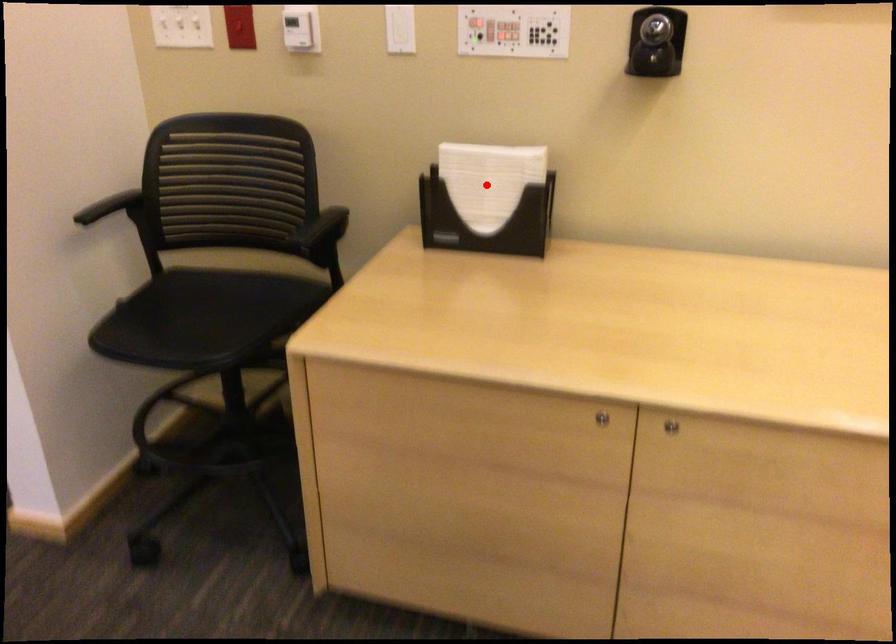
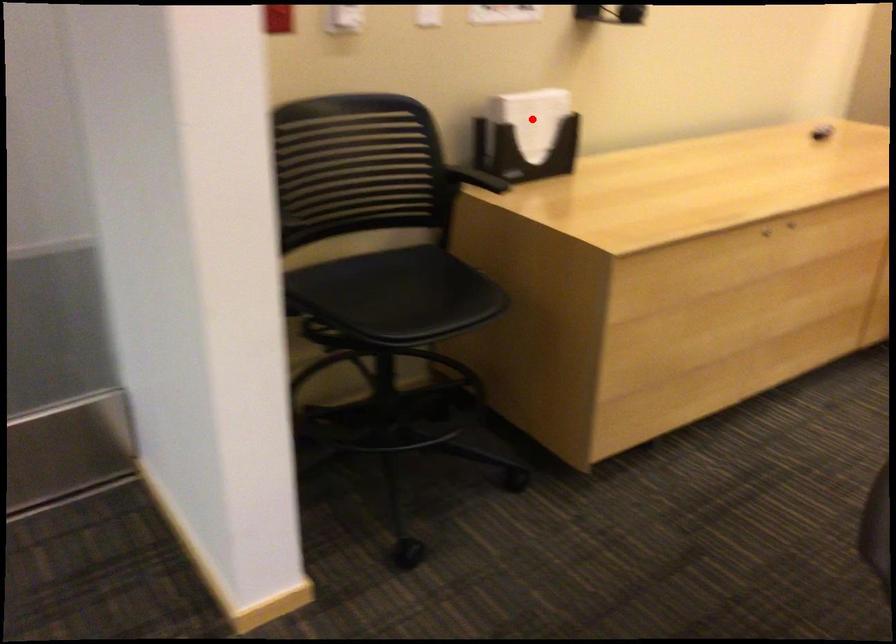
I am providing you with two images of the same scene from different viewpoints. A red point is marked on the first image and another point is marked on the second image. Is the marked point in image1 the same physical position as the marked point in image2?

Yes